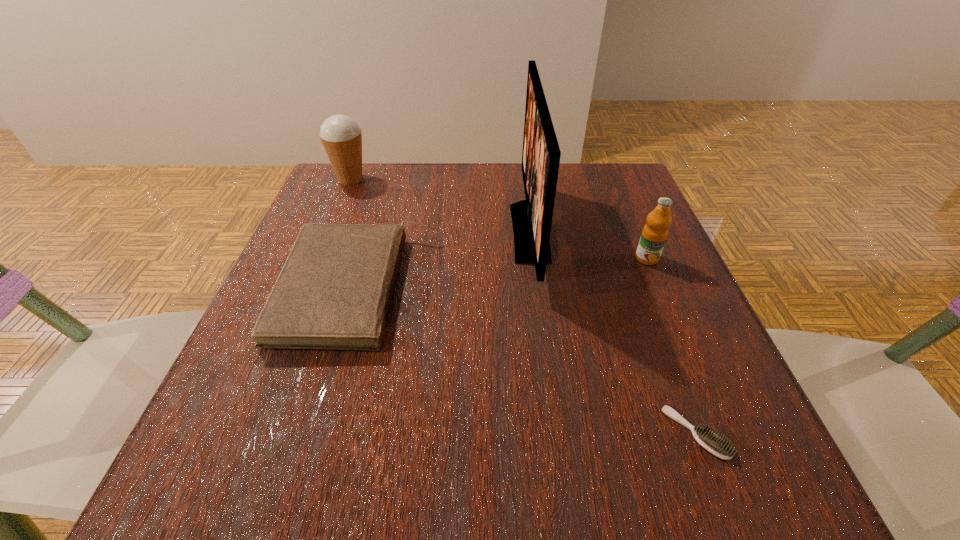
This screenshot has height=540, width=960. I want to click on free space located on the right of the fourth shortest object, so click(x=407, y=179).

Locate an element on the screen. The image size is (960, 540). vacant space located 0.160m on the label of the third shortest object is located at coordinates (677, 329).

Where is `blank space located 0.240m on the spine side of the paperback book`? The height and width of the screenshot is (540, 960). blank space located 0.240m on the spine side of the paperback book is located at coordinates (564, 288).

This screenshot has width=960, height=540. Find the location of `free spot located 0.300m on the back of the scrubbing brush`. free spot located 0.300m on the back of the scrubbing brush is located at coordinates (634, 268).

Image resolution: width=960 pixels, height=540 pixels. What are the coordinates of `monitor positioned at the far edge` in the screenshot? It's located at (532, 218).

Where is `icecream that is at the far edge`? This screenshot has width=960, height=540. icecream that is at the far edge is located at coordinates (341, 136).

This screenshot has width=960, height=540. I want to click on object that is at the near edge, so click(716, 445).

The width and height of the screenshot is (960, 540). I want to click on icecream at the left edge, so click(x=341, y=136).

I want to click on paperback book that is at the left edge, so click(334, 290).

This screenshot has height=540, width=960. What are the coordinates of `orange juice that is positioned at the right edge` in the screenshot? It's located at (655, 232).